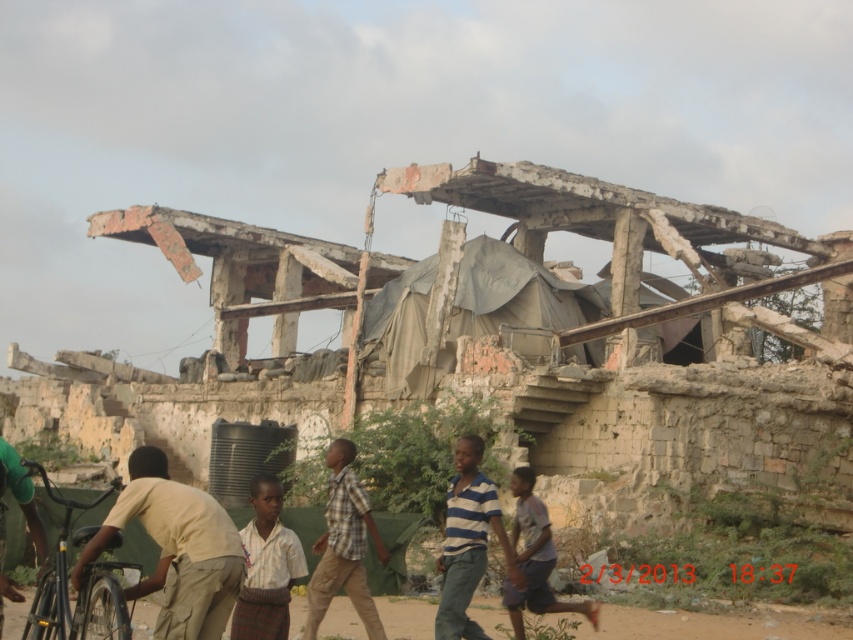
Question: Which is farther from the light beige fabric shirt at lower left?

Choices:
 (A) light brown plaid shirt at center
 (B) striped fabric shirt at center

Answer: (B)

Question: Which of the following is the closest to the observer?

Choices:
 (A) light beige fabric shirt at lower left
 (B) striped cotton shirt at center
 (C) light brown plaid shirt at center
 (D) striped fabric shirt at center

Answer: (A)

Question: Among these objects, which one is farthest from the camera?

Choices:
 (A) light brown plaid shirt at center
 (B) plaid shirt at center

Answer: (B)

Question: Is striped fabric shirt at center to the right of striped cotton shirt at center from the viewer's perspective?

Choices:
 (A) no
 (B) yes

Answer: (A)

Question: Is light beige fabric shirt at lower left bigger than plaid shirt at center?

Choices:
 (A) yes
 (B) no

Answer: (A)

Question: Is striped fabric shirt at center wider than plaid shirt at center?

Choices:
 (A) no
 (B) yes

Answer: (A)